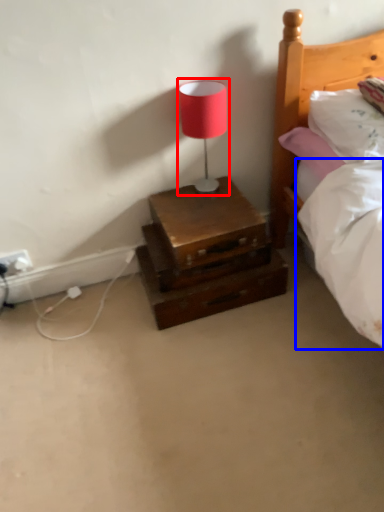
Question: Which of the following is the closest to the observer, table lamp (highlighted by a red box) or mattress (highlighted by a blue box)?

Choices:
 (A) table lamp
 (B) mattress

Answer: (B)